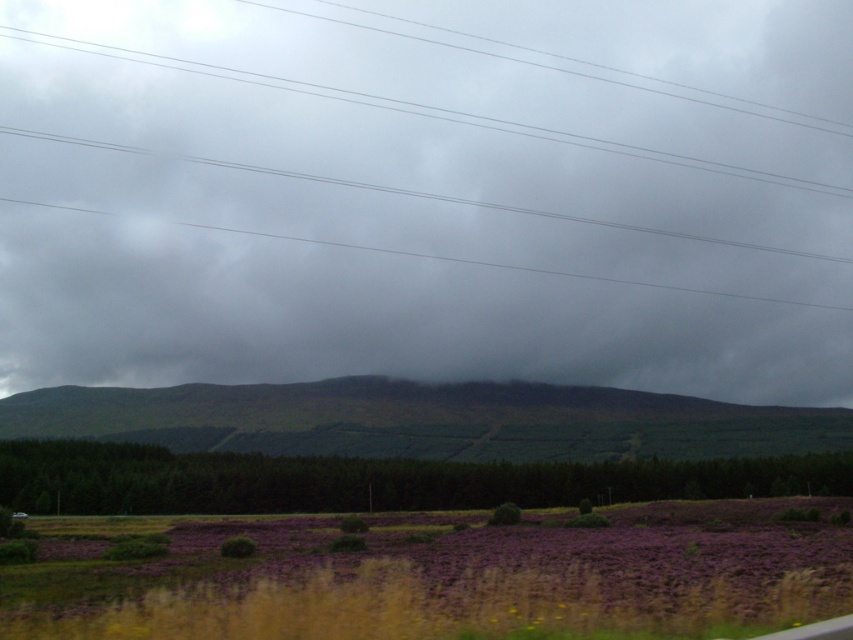
Question: Is gray matte cloud at center in front of purple soft-textured flowers at lower center?

Choices:
 (A) no
 (B) yes

Answer: (A)

Question: Estimate the real-world distances between objects in this image. Which object is closer to the purple soft-textured flowers at lower center?

Choices:
 (A) gray matte cloud at center
 (B) green grassy hill at center

Answer: (B)

Question: Which point is farther to the camera?

Choices:
 (A) (730, 509)
 (B) (447, 348)
 (C) (322, 388)

Answer: (B)

Question: Is gray matte cloud at center above purple soft-textured flowers at lower center?

Choices:
 (A) yes
 (B) no

Answer: (A)

Question: Does purple soft-textured flowers at lower center appear on the right side of green grassy hill at center?

Choices:
 (A) yes
 (B) no

Answer: (A)

Question: Among these objects, which one is farthest from the camera?

Choices:
 (A) purple soft-textured flowers at lower center
 (B) green grassy hill at center
 (C) gray matte cloud at center

Answer: (C)